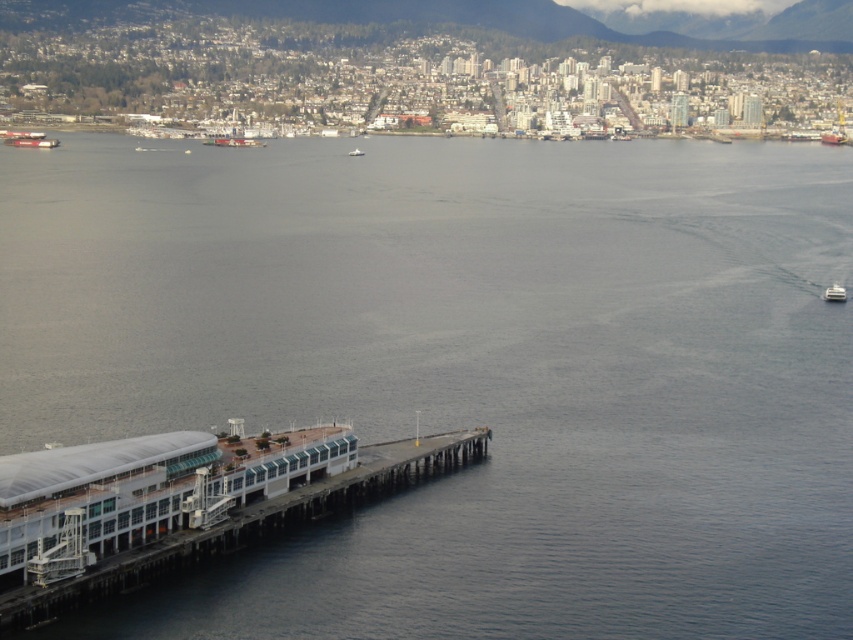
You are a photographer planning to capture a wide shot of the harbor. You notice the metallic gray ship at left and the white plastic boat at lower right. Which vessel should you focus on to ensure it takes up more space in your photo?

The metallic gray ship at left is bigger than the white plastic boat at lower right, so focusing on it will ensure it takes up more space in your photo.

You are standing on the dock and see two white plastic boats in the water. Which boat is closer to the right side of the dock, the white plastic boat at lower right or the white plastic boat at center?

The white plastic boat at lower right is to the right of the white plastic boat at center, so it is closer to the right side of the dock.